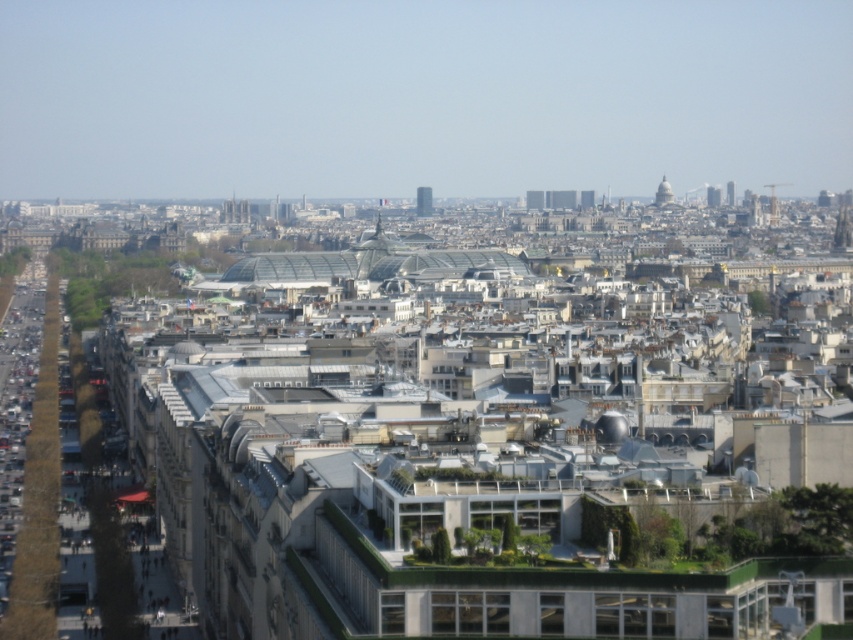
Question: Which point is closer to the camera taking this photo?

Choices:
 (A) (428, 212)
 (B) (733, 182)
 (C) (668, 196)
 (D) (706, 189)

Answer: (C)

Question: Is green glass tower at center closer to camera compared to matte glass spire at upper right?

Choices:
 (A) yes
 (B) no

Answer: (A)

Question: Considering the real-world distances, which object is farthest from the matte glass spire at upper right?

Choices:
 (A) smooth glass skyscraper at upper right
 (B) smooth glass spire at upper center
 (C) green glass tower at center

Answer: (C)

Question: Considering the relative positions of green glass tower at center and matte glass spire at upper right in the image provided, where is green glass tower at center located with respect to matte glass spire at upper right?

Choices:
 (A) below
 (B) above

Answer: (A)

Question: Among these points, which one is farthest from the camera?

Choices:
 (A) (706, 204)
 (B) (668, 195)
 (C) (428, 204)

Answer: (A)

Question: Observing the image, what is the correct spatial positioning of smooth glass spire at upper center in reference to smooth glass skyscraper at upper right?

Choices:
 (A) below
 (B) above

Answer: (A)